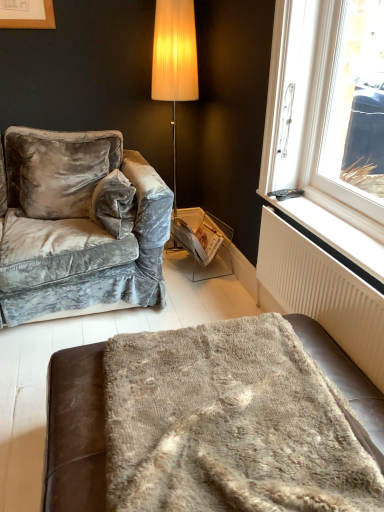
Image resolution: width=384 pixels, height=512 pixels. Identify the location of free space above white plastic radiator at lower right (from a real-world perspective). (312, 209).